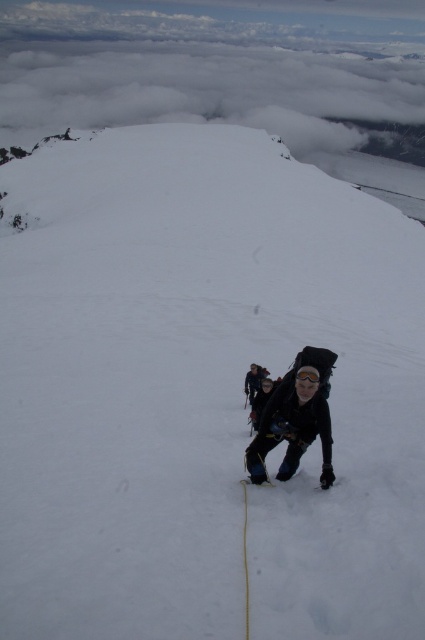
Looking at this image, is white nylon rope at center smaller than matte black backpack at center?

Yes, white nylon rope at center is smaller than matte black backpack at center.

Where is `white nylon rope at center`? The height and width of the screenshot is (640, 425). white nylon rope at center is located at coordinates (246, 561).

Which is behind, point (275, 401) or point (248, 385)?

The point (248, 385) is more distant.

The height and width of the screenshot is (640, 425). What do you see at coordinates (292, 426) in the screenshot? I see `black matte jacket at center` at bounding box center [292, 426].

Is point (246, 449) less distant than point (265, 372)?

Yes, it is.

At what (x,y) coordinates should I click in order to perform the action: click on black matte jacket at center. Please return your answer as a coordinate pair (x, y). Looking at the image, I should click on pyautogui.click(x=292, y=426).

Which is more to the right, black matte jacket at center or white nylon rope at center?

From the viewer's perspective, black matte jacket at center appears more on the right side.

Is point (255, 452) behind point (246, 552)?

Yes, point (255, 452) is farther from viewer.

The image size is (425, 640). Describe the element at coordinates (292, 426) in the screenshot. I see `black matte jacket at center` at that location.

At what (x,y) coordinates should I click in order to perform the action: click on black matte jacket at center. Please return your answer as a coordinate pair (x, y). Image resolution: width=425 pixels, height=640 pixels. Looking at the image, I should click on (292, 426).